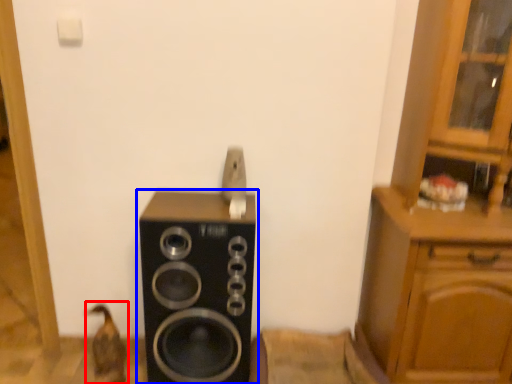
Question: Which object appears closest to the camera in this image, animal (highlighted by a red box) or home appliance (highlighted by a blue box)?

Choices:
 (A) animal
 (B) home appliance

Answer: (B)